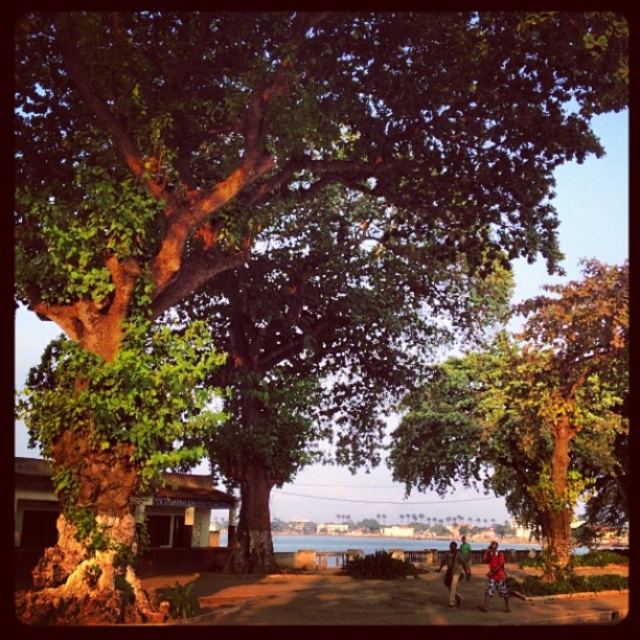
Does red fabric person at lower right have a larger size compared to brown textured shirt at lower right?

Indeed, red fabric person at lower right has a larger size compared to brown textured shirt at lower right.

Describe the element at coordinates (493, 577) in the screenshot. The image size is (640, 640). I see `red fabric person at lower right` at that location.

Does point (500, 588) come in front of point (452, 595)?

Yes, it is.

Identify the location of red fabric person at lower right. (493, 577).

Image resolution: width=640 pixels, height=640 pixels. What do you see at coordinates (532, 410) in the screenshot?
I see `green leafy tree at center` at bounding box center [532, 410].

The width and height of the screenshot is (640, 640). Identify the location of green leafy tree at center. (532, 410).

Is red fabric person at lower right wider than green fabric shirt at lower right?

Incorrect, red fabric person at lower right's width does not surpass green fabric shirt at lower right's.

Which is in front, point (486, 576) or point (464, 577)?

Point (486, 576)

Who is more distant from viewer, (502, 593) or (467, 544)?

The point (467, 544) is more distant.

Identify the location of red fabric person at lower right. (493, 577).